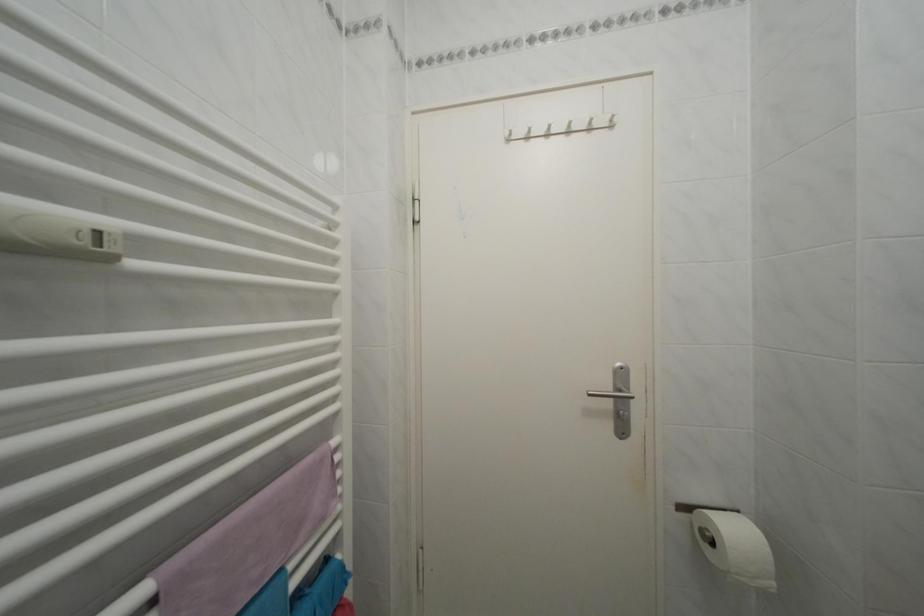
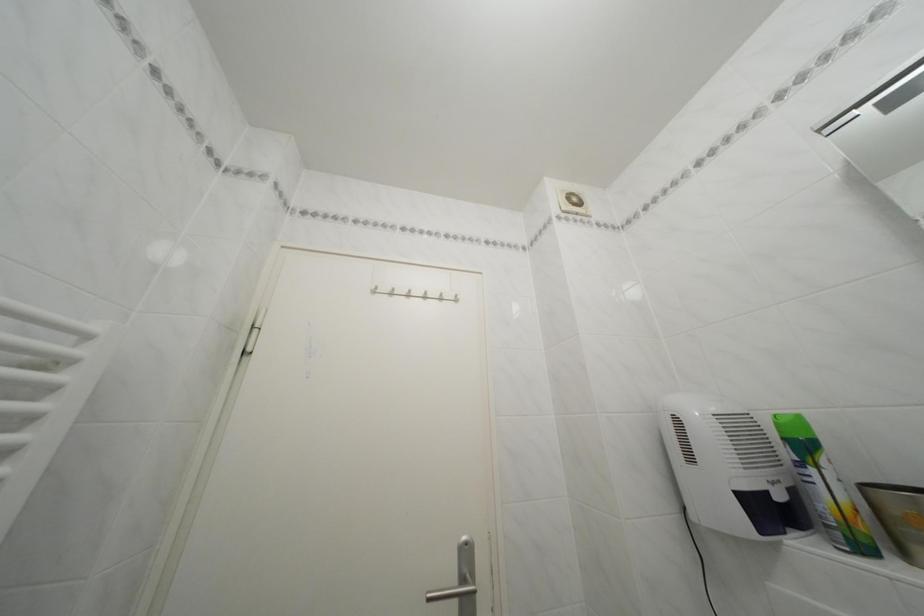
From the picture: The images are taken continuously from a first-person perspective. In which direction is your viewpoint rotating?

The camera's rotation is toward right-up.